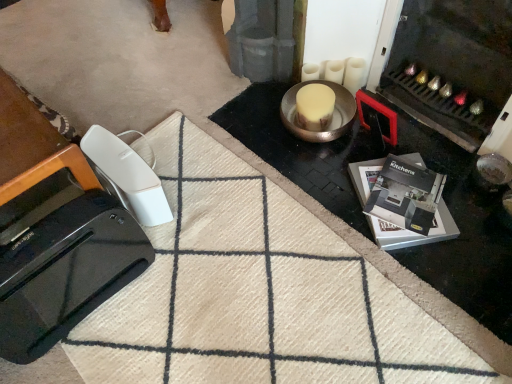
Question: From a real-world perspective, is white plastic remote at lower left, marked as the second home appliance in a front-to-back arrangement, positioned under black glossy kitchens brochure at lower right based on gravity?

Choices:
 (A) no
 (B) yes

Answer: (A)

Question: Does white plastic remote at lower left, the 1th home appliance from the back, have a lesser width compared to black glossy kitchens brochure at lower right?

Choices:
 (A) no
 (B) yes

Answer: (B)

Question: From a real-world perspective, is white plastic remote at lower left, the 1th home appliance from the back, located higher than black glossy kitchens brochure at lower right?

Choices:
 (A) yes
 (B) no

Answer: (A)

Question: Does white plastic remote at lower left, the 1th home appliance from the back, turn towards black glossy kitchens brochure at lower right?

Choices:
 (A) no
 (B) yes

Answer: (A)

Question: From the image's perspective, would you say white plastic remote at lower left, the 1th home appliance from the back, is shown under black glossy kitchens brochure at lower right?

Choices:
 (A) yes
 (B) no

Answer: (B)

Question: Is white plastic remote at lower left, the 1th home appliance from the back, positioned in front of black glossy kitchens brochure at lower right?

Choices:
 (A) yes
 (B) no

Answer: (A)

Question: From the image's perspective, is beige woolen doormat at lower left over black glossy toaster at lower left, the 1th home appliance from the front?

Choices:
 (A) yes
 (B) no

Answer: (B)

Question: Is the position of beige woolen doormat at lower left more distant than that of black glossy toaster at lower left, the 1th home appliance from the front?

Choices:
 (A) no
 (B) yes

Answer: (A)

Question: Considering the relative positions of beige woolen doormat at lower left and black glossy toaster at lower left, the 1th home appliance from the front, in the image provided, is beige woolen doormat at lower left to the left of black glossy toaster at lower left, the 1th home appliance from the front, from the viewer's perspective?

Choices:
 (A) no
 (B) yes

Answer: (A)

Question: Is black glossy toaster at lower left, acting as the 2th home appliance starting from the back, a part of beige woolen doormat at lower left?

Choices:
 (A) yes
 (B) no

Answer: (B)

Question: From the image's perspective, would you say beige woolen doormat at lower left is shown under black glossy toaster at lower left, the 1th home appliance from the front?

Choices:
 (A) yes
 (B) no

Answer: (A)

Question: Is beige woolen doormat at lower left beside black glossy toaster at lower left, the 1th home appliance from the front?

Choices:
 (A) no
 (B) yes

Answer: (A)

Question: Is the depth of beige woolen doormat at lower left greater than that of white plastic remote at lower left, the 1th home appliance from the back?

Choices:
 (A) no
 (B) yes

Answer: (A)